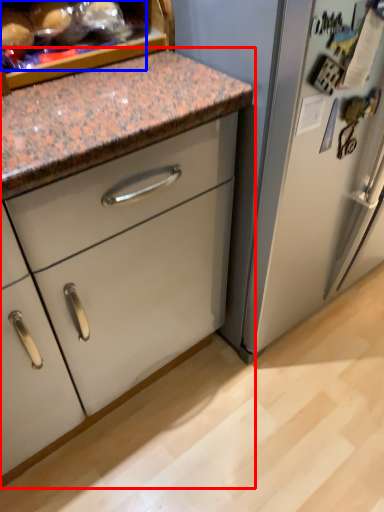
Question: Among these objects, which one is nearest to the camera, cabinetry (highlighted by a red box) or food (highlighted by a blue box)?

Choices:
 (A) cabinetry
 (B) food

Answer: (B)